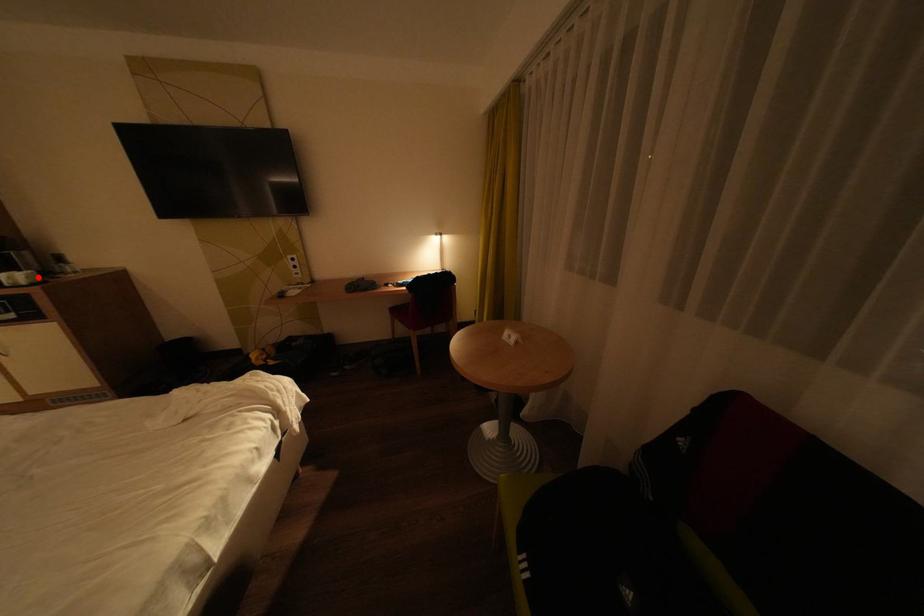
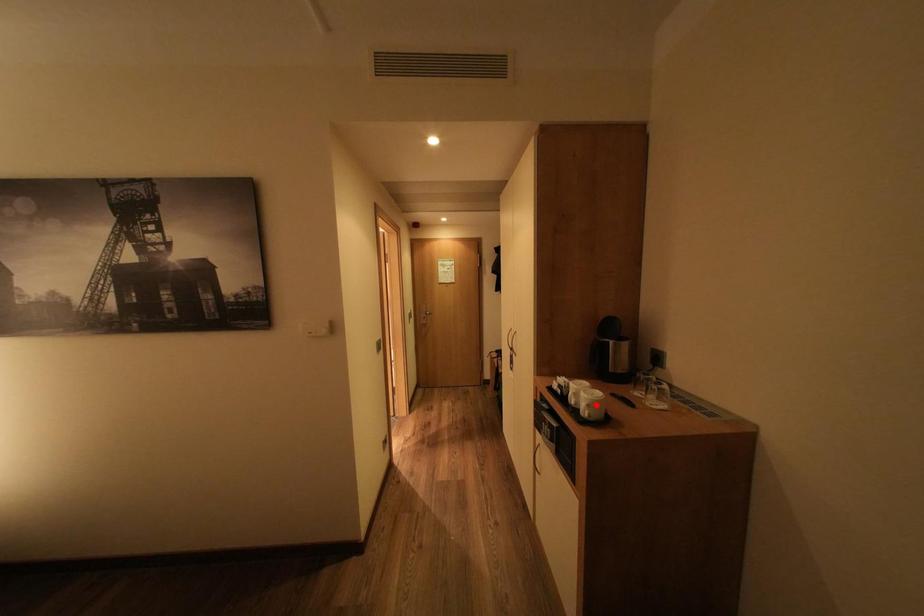
I am providing you with two images of the same scene from different viewpoints. A red point is marked on the first image and another point is marked on the second image. Do the highlighted points in image1 and image2 indicate the same real-world spot?

No